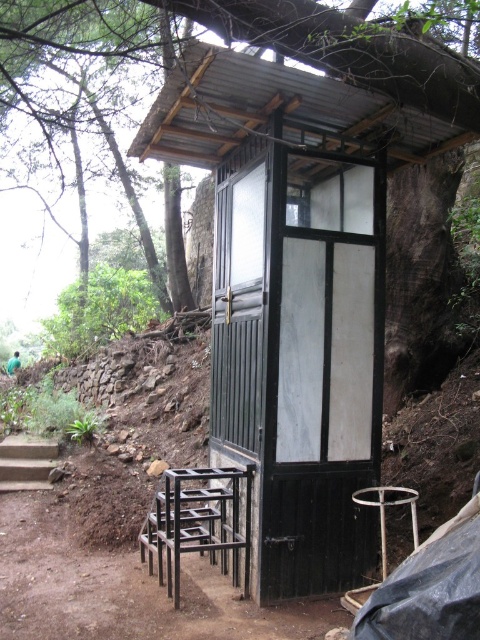
Can you confirm if black metal stool at lower left is taller than concrete stairs at lower left?

Correct, black metal stool at lower left is much taller as concrete stairs at lower left.

Can you confirm if black metal stool at lower left is smaller than concrete stairs at lower left?

No.

In the scene shown: Who is more forward, (169, 576) or (27, 449)?

Point (169, 576)

Identify the location of black metal stool at lower left. The image size is (480, 640). (196, 522).

Is black wood/paneling toilet at center above black metal stool at lower left?

Yes, black wood/paneling toilet at center is above black metal stool at lower left.

Does black wood/paneling toilet at center have a greater height compared to black metal stool at lower left?

Indeed, black wood/paneling toilet at center has a greater height compared to black metal stool at lower left.

The height and width of the screenshot is (640, 480). Describe the element at coordinates (295, 292) in the screenshot. I see `black wood/paneling toilet at center` at that location.

The width and height of the screenshot is (480, 640). I want to click on black wood/paneling toilet at center, so click(x=295, y=292).

Consider the image. Who is higher up, black wood/paneling toilet at center or metallic black stool at center?

black wood/paneling toilet at center is higher up.

Which is behind, point (325, 592) or point (380, 486)?

The point (380, 486) is more distant.

Identify the location of black wood/paneling toilet at center. (295, 292).